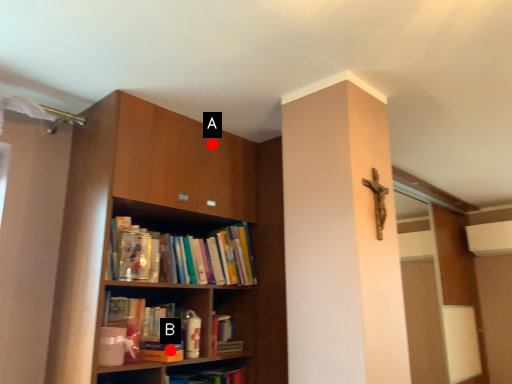
Question: Two points are circled on the image, labeled by A and B beside each circle. Which point appears farthest from the camera in this image?

Choices:
 (A) A is further
 (B) B is further

Answer: (A)